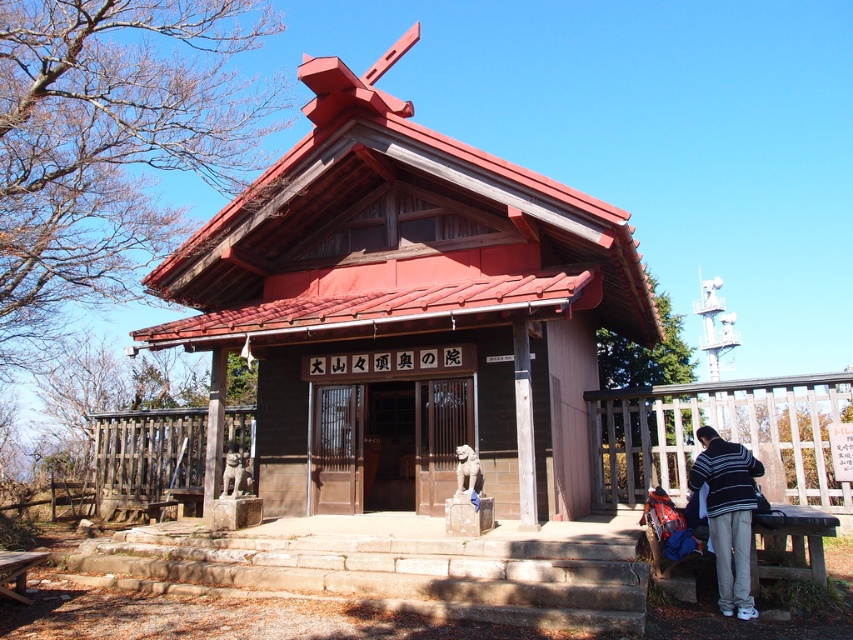
You are planning to set up a small event in the area shown in the image. You need to place a 20 feet long banner between the striped sweater at lower right and the brown wooden picnic table at lower left. Is there enough space to stretch the banner fully without folding it?

The distance between the striped sweater at lower right and the brown wooden picnic table at lower left is 22.93 feet, which is longer than the 20 feet banner. Therefore, there is sufficient space to stretch the banner fully without folding it.

You are planning to take a photo of the wooden temple at center and the brown wooden picnic table at lower left from a position where both are visible. Which object will appear larger in the photo?

The brown wooden picnic table at lower left will appear larger in the photo because it is larger in size compared to the wooden temple at center.